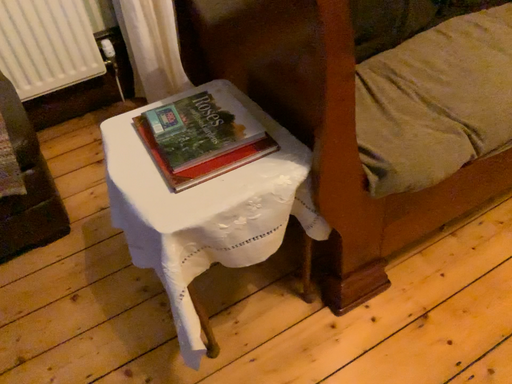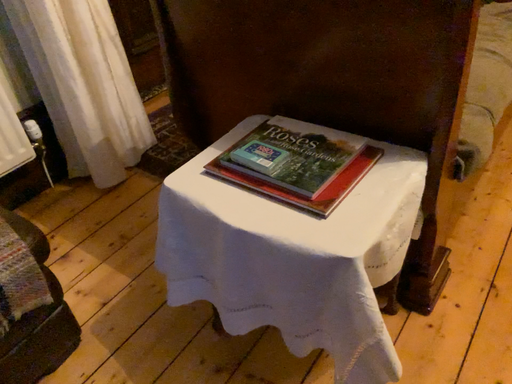
Question: How did the camera likely rotate when shooting the video?

Choices:
 (A) rotated downward
 (B) rotated upward

Answer: (B)